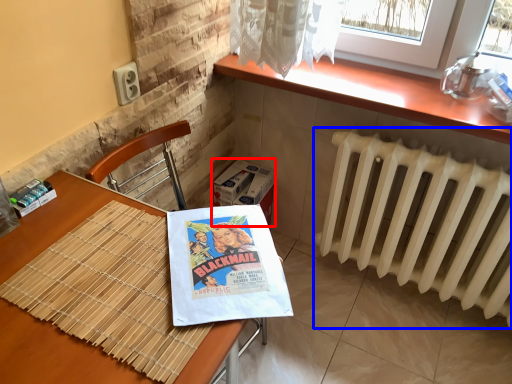
Question: Which point is further to the camera, cardboard box (highlighted by a red box) or radiator (highlighted by a blue box)?

Choices:
 (A) cardboard box
 (B) radiator

Answer: (A)